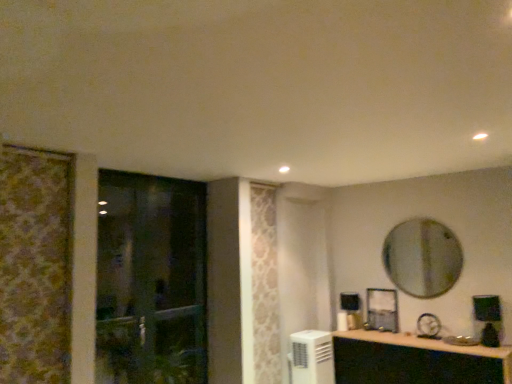
This screenshot has height=384, width=512. What do you see at coordinates (151, 280) in the screenshot?
I see `transparent glass door at left` at bounding box center [151, 280].

This screenshot has width=512, height=384. In order to click on transparent glass door at left in this screenshot , I will do `click(151, 280)`.

Is matte black cabinet at lower right thinner than white plastic air conditioner at lower center?

No.

Between point (374, 369) and point (290, 338), which one is positioned behind?

Positioned behind is point (290, 338).

From a real-world perspective, which is physically below, matte black cabinet at lower right or white plastic air conditioner at lower center?

matte black cabinet at lower right.

Considering the sizes of objects matte black cabinet at lower right and white plastic air conditioner at lower center in the image provided, who is bigger, matte black cabinet at lower right or white plastic air conditioner at lower center?

matte black cabinet at lower right is bigger.

Is white plastic air conditioner at lower center situated inside silver metallic mirror at upper right or outside?

The correct answer is: outside.

From the image's perspective, who appears lower, white plastic air conditioner at lower center or silver metallic mirror at upper right?

white plastic air conditioner at lower center appears lower in the image.

From the picture: How many degrees apart are the facing directions of white plastic air conditioner at lower center and silver metallic mirror at upper right?

The facing directions of white plastic air conditioner at lower center and silver metallic mirror at upper right are 87 degrees apart.

Which point is more forward, (294, 363) or (412, 236)?

The point (294, 363) is closer.

Where is `door in front of the white plastic air conditioner at lower center`? The height and width of the screenshot is (384, 512). door in front of the white plastic air conditioner at lower center is located at coordinates (151, 280).

Between point (312, 381) and point (117, 235), which one is positioned in front?

The point (117, 235) is closer.

Do you think white plastic air conditioner at lower center is within transparent glass door at left, or outside of it?

white plastic air conditioner at lower center cannot be found inside transparent glass door at left.

From the image's perspective, is white plastic air conditioner at lower center located above or below transparent glass door at left?

white plastic air conditioner at lower center is situated lower than transparent glass door at left in the image.

In terms of size, does white plastic air conditioner at lower center appear bigger or smaller than matte black cabinet at lower right?

white plastic air conditioner at lower center is smaller than matte black cabinet at lower right.

Is white plastic air conditioner at lower center oriented away from matte black cabinet at lower right?

white plastic air conditioner at lower center does not have its back to matte black cabinet at lower right.

Between white plastic air conditioner at lower center and matte black cabinet at lower right, which one appears on the right side from the viewer's perspective?

matte black cabinet at lower right is more to the right.

Can we say white plastic air conditioner at lower center lies outside matte black cabinet at lower right?

white plastic air conditioner at lower center lies outside matte black cabinet at lower right's area.

Is matte black cabinet at lower right at the left side of transparent glass door at left?

In fact, matte black cabinet at lower right is to the right of transparent glass door at left.

Is matte black cabinet at lower right wider or thinner than transparent glass door at left?

matte black cabinet at lower right is wider than transparent glass door at left.

Could you tell me if matte black cabinet at lower right is turned towards transparent glass door at left?

No, matte black cabinet at lower right is not aimed at transparent glass door at left.

Can you see matte black cabinet at lower right touching transparent glass door at left?

matte black cabinet at lower right and transparent glass door at left are not in contact.

From the image's perspective, is transparent glass door at left under silver metallic mirror at upper right?

Indeed, from the image's perspective, transparent glass door at left is shown beneath silver metallic mirror at upper right.

How different are the orientations of transparent glass door at left and silver metallic mirror at upper right in degrees?

transparent glass door at left and silver metallic mirror at upper right are facing 88 degrees away from each other.

Which of these two, transparent glass door at left or silver metallic mirror at upper right, stands taller?

With more height is transparent glass door at left.

Can you confirm if transparent glass door at left is bigger than silver metallic mirror at upper right?

Yes.

In terms of height, does silver metallic mirror at upper right look taller or shorter compared to transparent glass door at left?

silver metallic mirror at upper right is shorter than transparent glass door at left.

Who is bigger, silver metallic mirror at upper right or transparent glass door at left?

transparent glass door at left is bigger.

Does silver metallic mirror at upper right have a greater width compared to transparent glass door at left?

Incorrect, the width of silver metallic mirror at upper right does not surpass that of transparent glass door at left.

Is silver metallic mirror at upper right turned away from transparent glass door at left?

silver metallic mirror at upper right does not have its back to transparent glass door at left.

Image resolution: width=512 pixels, height=384 pixels. I want to click on air conditioner located behind the matte black cabinet at lower right, so click(x=312, y=357).

The height and width of the screenshot is (384, 512). I want to click on mirror that appears in front of the white plastic air conditioner at lower center, so click(x=422, y=258).

Estimate the real-world distances between objects in this image. Which object is further from white plastic air conditioner at lower center, matte black cabinet at lower right or silver metallic mirror at upper right?

silver metallic mirror at upper right is further to white plastic air conditioner at lower center.

Considering their positions, is silver metallic mirror at upper right positioned closer to white plastic air conditioner at lower center than matte black cabinet at lower right?

The object closer to white plastic air conditioner at lower center is matte black cabinet at lower right.

Estimate the real-world distances between objects in this image. Which object is closer to matte black cabinet at lower right, transparent glass door at left or white plastic air conditioner at lower center?

Based on the image, white plastic air conditioner at lower center appears to be nearer to matte black cabinet at lower right.

Looking at the image, which one is located closer to white plastic air conditioner at lower center, silver metallic mirror at upper right or transparent glass door at left?

silver metallic mirror at upper right is positioned closer to the anchor white plastic air conditioner at lower center.

Looking at the image, which one is located closer to matte black cabinet at lower right, white plastic air conditioner at lower center or silver metallic mirror at upper right?

white plastic air conditioner at lower center is positioned closer to the anchor matte black cabinet at lower right.

When comparing their distances from matte black cabinet at lower right, does silver metallic mirror at upper right or white plastic air conditioner at lower center seem further?

Based on the image, silver metallic mirror at upper right appears to be further to matte black cabinet at lower right.

Estimate the real-world distances between objects in this image. Which object is further from silver metallic mirror at upper right, transparent glass door at left or matte black cabinet at lower right?

transparent glass door at left is positioned further to the anchor silver metallic mirror at upper right.

From the image, which object appears to be nearer to silver metallic mirror at upper right, white plastic air conditioner at lower center or transparent glass door at left?

white plastic air conditioner at lower center is closer to silver metallic mirror at upper right.

Locate an element on the screen. The width and height of the screenshot is (512, 384). cabinetry that lies between silver metallic mirror at upper right and white plastic air conditioner at lower center from top to bottom is located at coordinates (415, 360).

Where is `air conditioner between transparent glass door at left and matte black cabinet at lower right`? air conditioner between transparent glass door at left and matte black cabinet at lower right is located at coordinates (312, 357).

Locate an element on the screen. This screenshot has height=384, width=512. air conditioner between transparent glass door at left and silver metallic mirror at upper right in the horizontal direction is located at coordinates (312, 357).

Image resolution: width=512 pixels, height=384 pixels. Find the location of `cabinetry located between transparent glass door at left and silver metallic mirror at upper right in the left-right direction`. cabinetry located between transparent glass door at left and silver metallic mirror at upper right in the left-right direction is located at coordinates (415, 360).